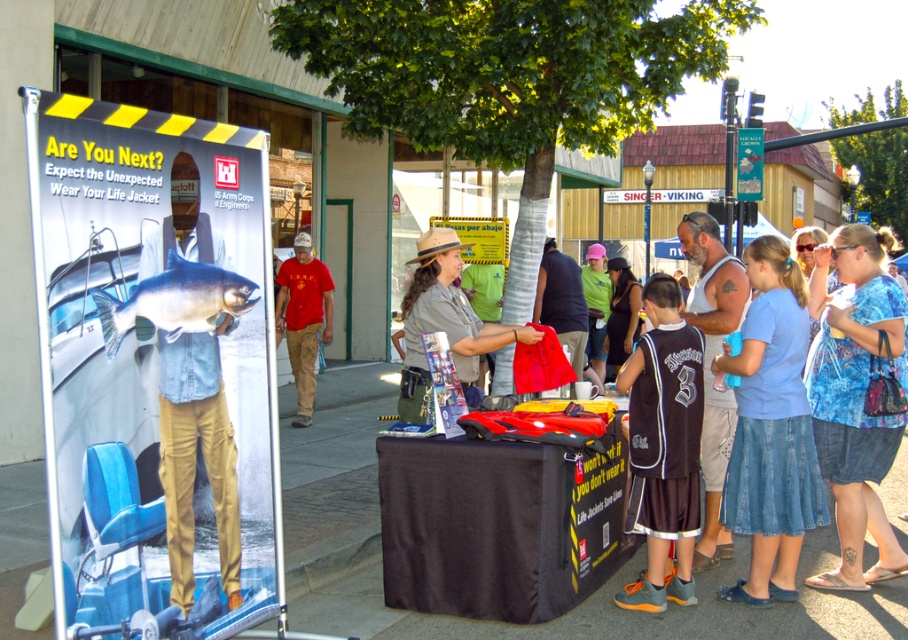
Can you confirm if blue denim shorts at lower right is smaller than black jersey at center?

Incorrect, blue denim shorts at lower right is not smaller in size than black jersey at center.

Does blue denim shorts at lower right have a lesser height compared to black jersey at center?

No.

What do you see at coordinates (855, 396) in the screenshot? The width and height of the screenshot is (908, 640). I see `blue denim shorts at lower right` at bounding box center [855, 396].

Where is `blue denim shorts at lower right`? This screenshot has width=908, height=640. blue denim shorts at lower right is located at coordinates (855, 396).

Is denim skirt at center positioned behind red cotton shirt at center?

No, it is in front of red cotton shirt at center.

Does denim skirt at center appear on the left side of red cotton shirt at center?

Incorrect, denim skirt at center is not on the left side of red cotton shirt at center.

What do you see at coordinates (782, 417) in the screenshot?
I see `denim skirt at center` at bounding box center [782, 417].

Locate an element on the screen. denim skirt at center is located at coordinates (782, 417).

Which of these two, black jersey at center or red cotton shirt at center, stands shorter?

Standing shorter between the two is black jersey at center.

How distant is black jersey at center from red cotton shirt at center?

black jersey at center and red cotton shirt at center are 6.05 meters apart from each other.

The width and height of the screenshot is (908, 640). What do you see at coordinates (663, 445) in the screenshot? I see `black jersey at center` at bounding box center [663, 445].

In order to click on black jersey at center in this screenshot , I will do `click(663, 445)`.